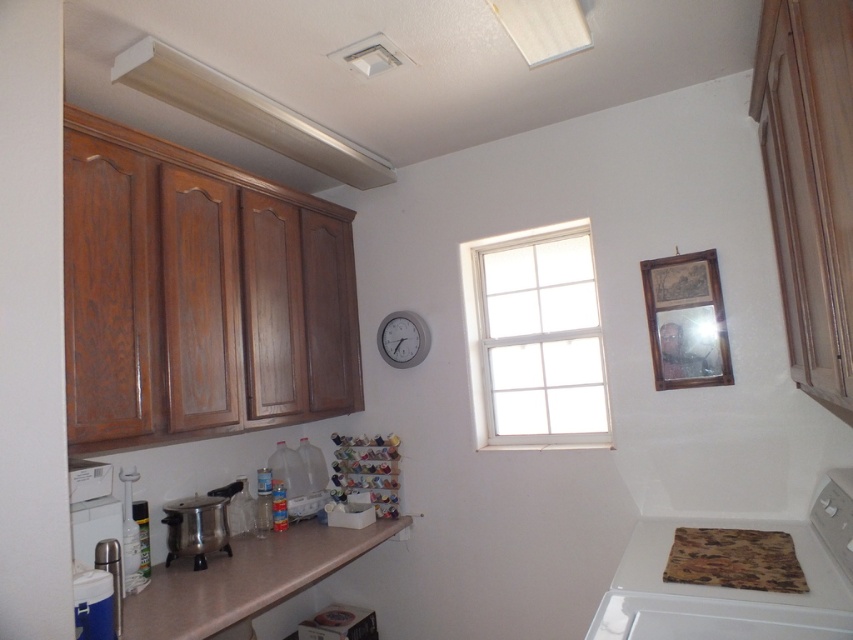
Question: Is white glossy exhaust hood at upper center to the left of white plastic clock at upper center from the viewer's perspective?

Choices:
 (A) yes
 (B) no

Answer: (A)

Question: Which point is farther to the camera?

Choices:
 (A) white plastic clock at upper center
 (B) white glossy exhaust hood at upper center
 (C) white glass window at center
 (D) stainless steel pot at lower left

Answer: (A)

Question: Which object is the closest to the stainless steel pot at lower left?

Choices:
 (A) white glass window at center
 (B) tan laminate counter top at lower center

Answer: (B)

Question: Does white glossy exhaust hood at upper center come in front of white plastic clock at upper center?

Choices:
 (A) yes
 (B) no

Answer: (A)

Question: Is tan laminate counter top at lower center positioned in front of white glossy exhaust hood at upper center?

Choices:
 (A) yes
 (B) no

Answer: (A)

Question: Which point is farther to the camera?

Choices:
 (A) white glass window at center
 (B) tan laminate counter top at lower center

Answer: (A)